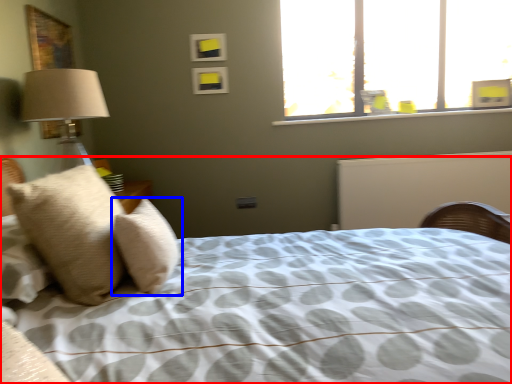
Question: Which of the following is the closest to the observer, bed (highlighted by a red box) or pillow (highlighted by a blue box)?

Choices:
 (A) bed
 (B) pillow

Answer: (A)